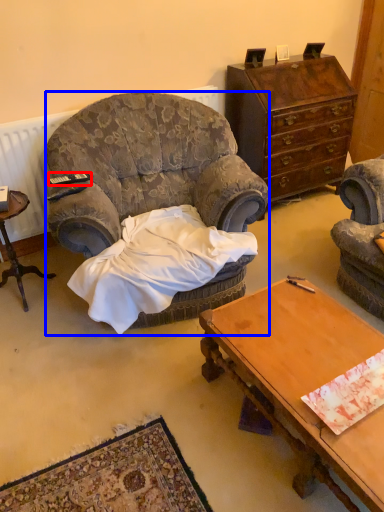
Question: Which point is closer to the camera, remote control (highlighted by a red box) or chair (highlighted by a blue box)?

Choices:
 (A) remote control
 (B) chair

Answer: (B)